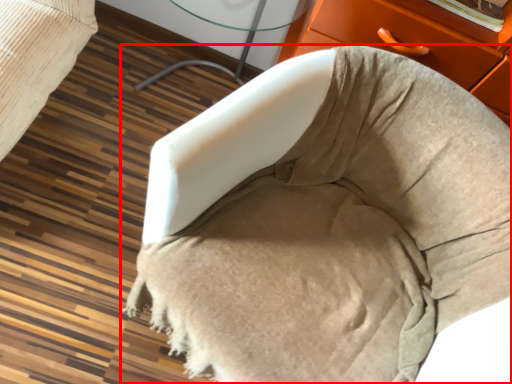
Question: Considering the relative positions of furniture (annotated by the red box) and table in the image provided, where is furniture (annotated by the red box) located with respect to the staircase?

Choices:
 (A) left
 (B) right

Answer: (B)